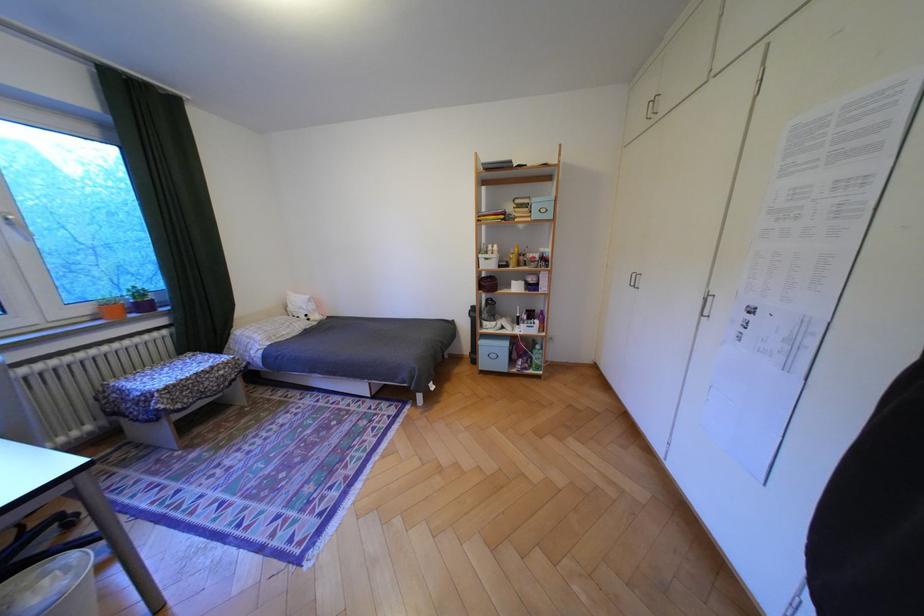
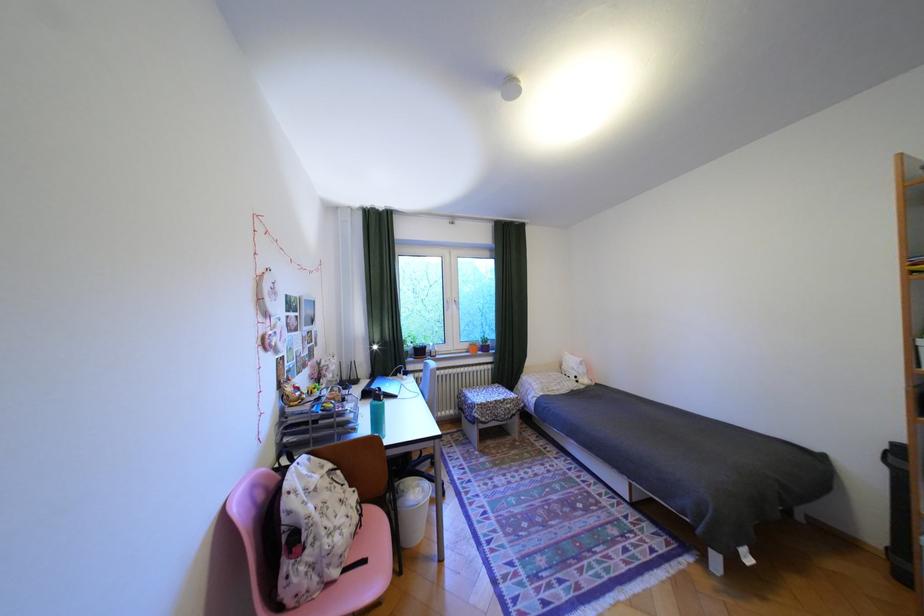
Question: The camera is either moving clockwise (left) or counter-clockwise (right) around the object. The first image is from the beginning of the video and the second image is from the end. Is the camera moving left or right when shooting the video?

Choices:
 (A) Left
 (B) Right

Answer: (B)